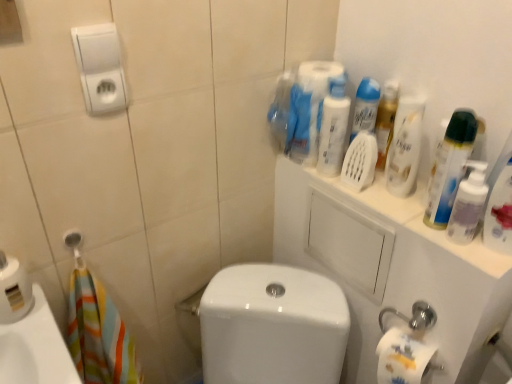
Question: Is white glossy porcelain at center, arranged as the first porcelain when viewed from the left, wider or thinner than white glossy porcelain at upper right, which ranks as the second porcelain in left-to-right order?

Choices:
 (A) wide
 (B) thin

Answer: (A)

Question: Is point (202, 311) positioned closer to the camera than point (395, 264)?

Choices:
 (A) closer
 (B) farther

Answer: (B)

Question: Which of these objects is positioned closest to the translucent plastic spray bottle at upper right, the fourth cleaning product from the left?

Choices:
 (A) transparent plastic mouthwash at upper right
 (B) white glossy porcelain at center, placed as the 2th porcelain when sorted from right to left
 (C) translucent plastic bottle at upper right, the 2th cleaning product positioned from the right
 (D) white glossy porcelain at upper right, which ranks as the second porcelain in left-to-right order
 (E) white plastic hand dryer at upper left

Answer: (A)

Question: Considering the real-world distances, which object is closest to the white glossy porcelain at upper right, which ranks as the second porcelain in left-to-right order?

Choices:
 (A) white glossy porcelain at center, placed as the 2th porcelain when sorted from right to left
 (B) white plastic hand dryer at upper left
 (C) transparent plastic mouthwash at upper right
 (D) white glossy shampoo at upper right, the 2th cleaning product positioned from the left
 (E) translucent plastic spray bottle at upper right, the 1th cleaning product positioned from the right

Answer: (A)